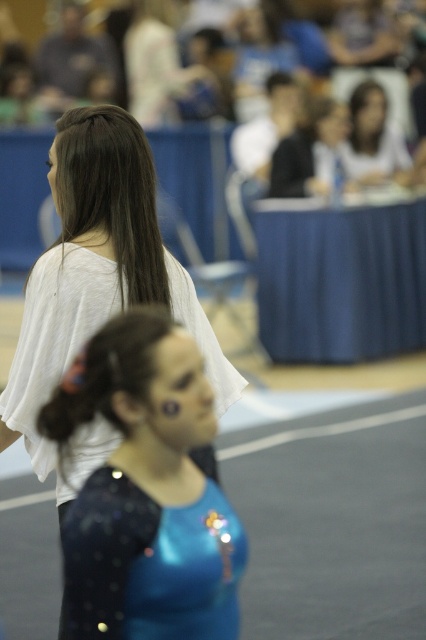
You are a photographer at the gymnastics event. You need to capture a closeup shot of the shiny blue leotard at center and the matte white shirt at upper center. Which object should you zoom in on to ensure it takes up more space in your photo?

The matte white shirt at upper center should be zoomed in on because it has a greater width than the shiny blue leotard at center, making it appear larger in the photo.

You are a photographer at the gymnastics event and need to position your camera to capture both the shiny blue leotard at center and the matte white shirt at upper center in the same frame. Based on their positions, which object should be placed on the left side of the frame?

The shiny blue leotard at center should be placed on the left side of the frame because it is to the left of the matte white shirt at upper center according to their positions.

You are a photographer trying to capture the gymnast in the center of the image. The gymnast is wearing a shiny blue leotard at lower center. According to the coordinates provided, where should you position your camera to ensure the gymnast is centered?

The shiny blue leotard at lower center is located at coordinates point (149,563). To center the gymnast, position your camera so that the center of the frame aligns with this coordinate point.